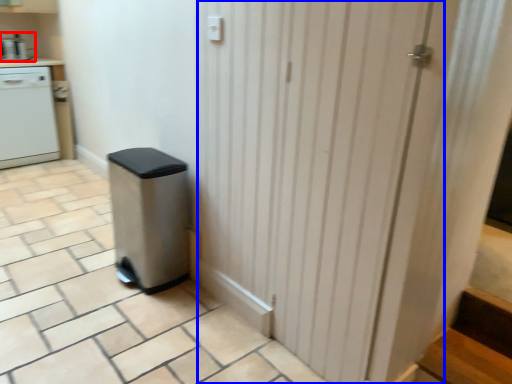
Question: Which object is further to the camera taking this photo, kitchen appliance (highlighted by a red box) or screen door (highlighted by a blue box)?

Choices:
 (A) kitchen appliance
 (B) screen door

Answer: (A)